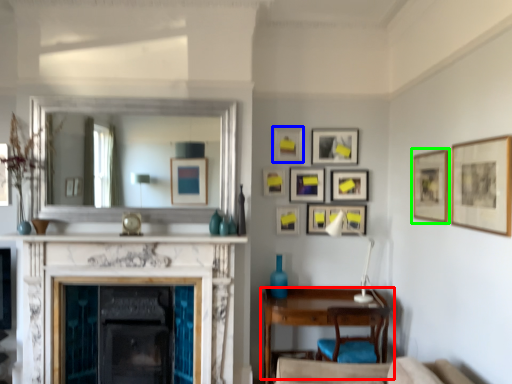
Question: Considering the real-world distances, which object is closest to table (highlighted by a red box)? picture frame (highlighted by a blue box) or picture frame (highlighted by a green box).

Choices:
 (A) picture frame
 (B) picture frame

Answer: (B)